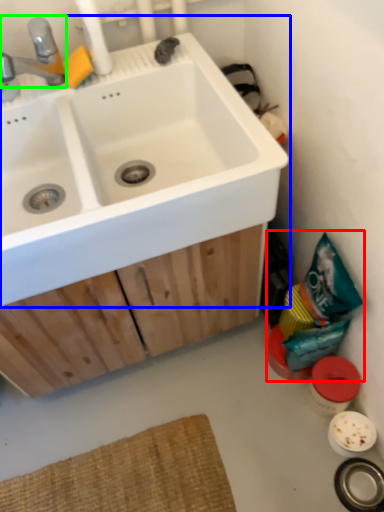
Question: Which object is the closest to the garbage (highlighted by a red box)? Choose among these: sink (highlighted by a blue box) or tap (highlighted by a green box).

Choices:
 (A) sink
 (B) tap

Answer: (A)